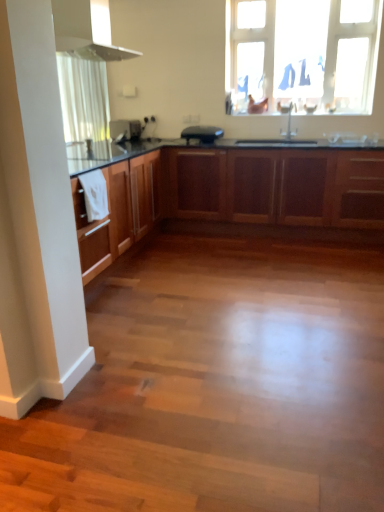
Locate an element on the screen. vacant space positioned to the left of satin nickel faucet at upper center is located at coordinates click(264, 143).